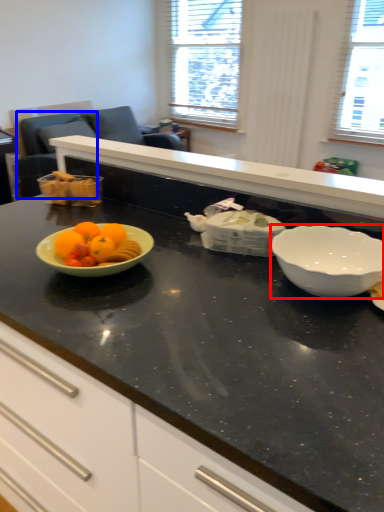
Question: Among these objects, which one is nearest to the camera, bowl (highlighted by a red box) or armchair (highlighted by a blue box)?

Choices:
 (A) bowl
 (B) armchair

Answer: (A)